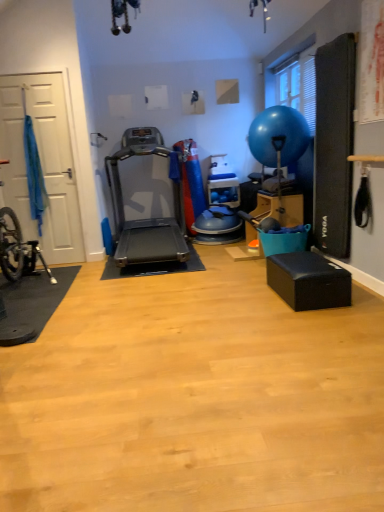
Question: Considering the relative sizes of blue rubber balloon at upper right and silver metallic treadmill at center in the image provided, is blue rubber balloon at upper right shorter than silver metallic treadmill at center?

Choices:
 (A) yes
 (B) no

Answer: (A)

Question: Does blue rubber balloon at upper right appear on the left side of silver metallic treadmill at center?

Choices:
 (A) no
 (B) yes

Answer: (A)

Question: Considering the relative sizes of blue rubber balloon at upper right and silver metallic treadmill at center in the image provided, is blue rubber balloon at upper right thinner than silver metallic treadmill at center?

Choices:
 (A) yes
 (B) no

Answer: (A)

Question: Is blue rubber balloon at upper right oriented away from silver metallic treadmill at center?

Choices:
 (A) no
 (B) yes

Answer: (A)

Question: From the image's perspective, is blue rubber balloon at upper right below silver metallic treadmill at center?

Choices:
 (A) yes
 (B) no

Answer: (B)

Question: Is blue rubber balloon at upper right in front of silver metallic treadmill at center?

Choices:
 (A) no
 (B) yes

Answer: (A)

Question: From the image's perspective, would you say white matte door at left is shown under blue rubber balloon at upper right?

Choices:
 (A) no
 (B) yes

Answer: (B)

Question: Is blue rubber balloon at upper right at the back of white matte door at left?

Choices:
 (A) yes
 (B) no

Answer: (B)

Question: Is white matte door at left positioned far away from blue rubber balloon at upper right?

Choices:
 (A) no
 (B) yes

Answer: (B)

Question: From a real-world perspective, is white matte door at left on top of blue rubber balloon at upper right?

Choices:
 (A) yes
 (B) no

Answer: (B)

Question: Does white matte door at left have a smaller size compared to blue rubber balloon at upper right?

Choices:
 (A) yes
 (B) no

Answer: (A)

Question: Considering the relative positions of white matte door at left and blue rubber balloon at upper right in the image provided, is white matte door at left to the left of blue rubber balloon at upper right from the viewer's perspective?

Choices:
 (A) yes
 (B) no

Answer: (A)

Question: Does silver metallic treadmill at center have a lesser width compared to white matte door at left?

Choices:
 (A) yes
 (B) no

Answer: (B)